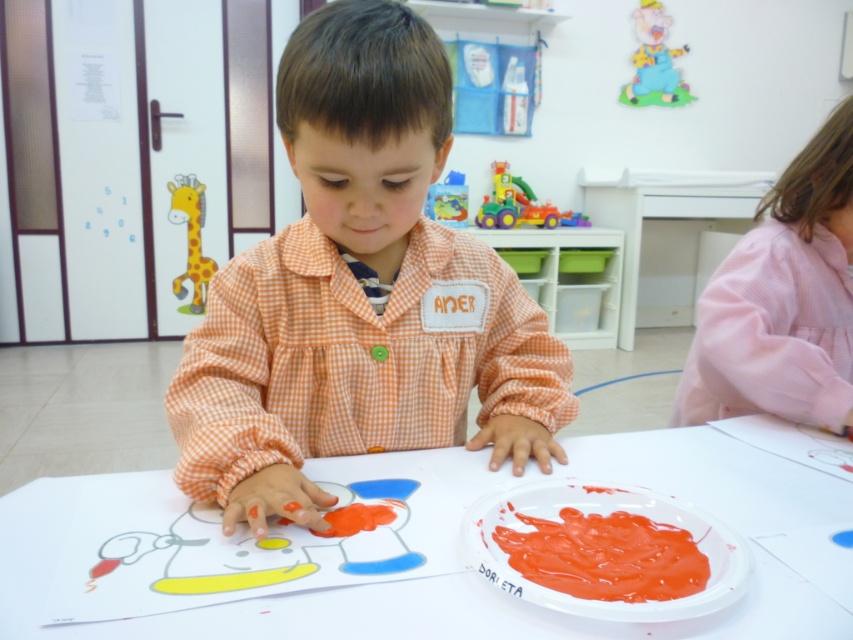
In the scene shown: You are a teacher in the classroom and want to place a new poster between the plastic multicolored toy truck at upper center and the cartoon giraffe at left. Do you think the space between them is wide enough to fit the poster?

The plastic multicolored toy truck at upper center might be wider than the cartoon giraffe at left, so the space between them may not be wide enough for the poster. Check the exact measurements before deciding.

What object is located at the coordinates point [520,204]?

The plastic multicolored toy truck at upper center is located at point [520,204].

You are a teacher observing the classroom scene. You notice two points marked on the image. The first point is at coordinate point (x=236, y=602) and the second at point (x=497, y=180). From the child and the teacher perspective, which point is closer to the child?

Point (x=236, y=602) is in front of point (x=497, y=180), so it is closer to the child.